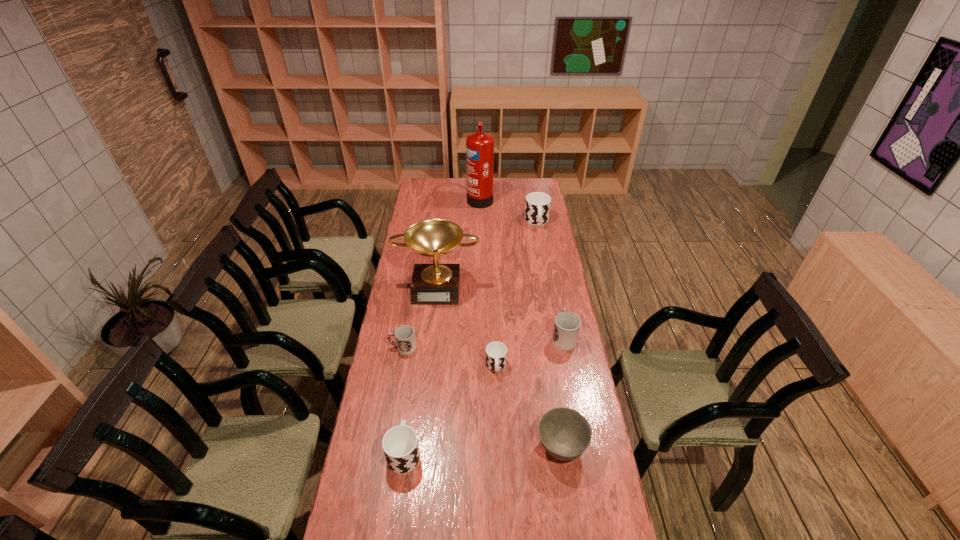
Locate an element on the screen. This screenshot has width=960, height=540. the left red cup is located at coordinates (405, 338).

What are the coordinates of `the second nearest black cup` in the screenshot? It's located at (496, 352).

This screenshot has width=960, height=540. I want to click on the third nearest object, so click(496, 352).

Where is `vacant space located 0.050m on the surface of the fire extinguisher`? This screenshot has width=960, height=540. vacant space located 0.050m on the surface of the fire extinguisher is located at coordinates point(459,198).

The width and height of the screenshot is (960, 540). What are the coordinates of `blank space located 0.270m on the surface of the fire extinguisher` in the screenshot? It's located at (421, 198).

Find the location of a particular element. The image size is (960, 540). free space located 0.100m on the surface of the fire extinguisher is located at coordinates (450, 198).

The width and height of the screenshot is (960, 540). Find the location of `free space located on the front-facing side of the sixth nearest object`. free space located on the front-facing side of the sixth nearest object is located at coordinates (428, 371).

Identify the location of free location located on the side of the farthest cup with the handle. (546, 274).

Where is `free region located on the handle side of the right red cup`? free region located on the handle side of the right red cup is located at coordinates (560, 315).

This screenshot has height=540, width=960. What are the coordinates of `free spot located 0.170m on the handle side of the right red cup` in the screenshot? It's located at (556, 296).